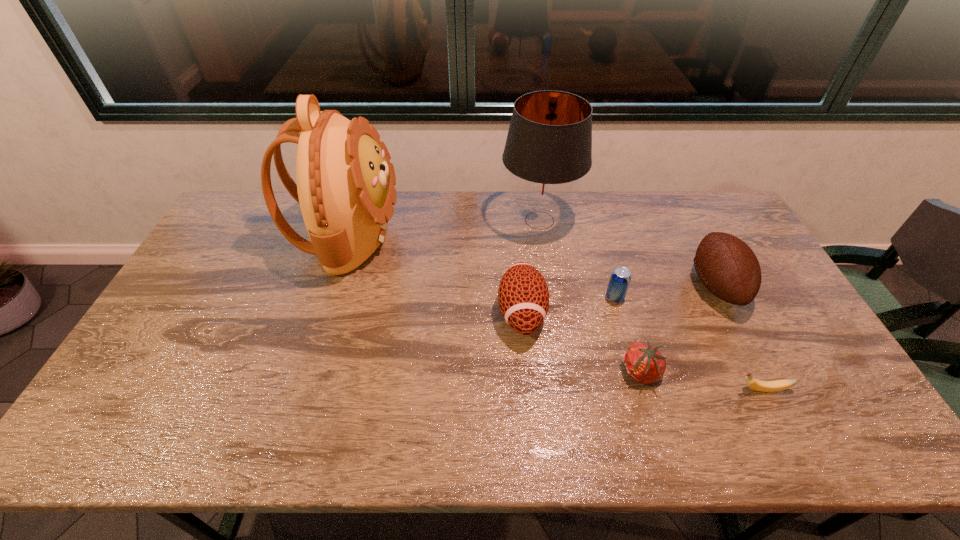
The height and width of the screenshot is (540, 960). What are the coordinates of `backpack` in the screenshot? It's located at (345, 181).

The height and width of the screenshot is (540, 960). What are the coordinates of `the sixth shortest object` in the screenshot? It's located at (548, 148).

The width and height of the screenshot is (960, 540). I want to click on the right football, so click(x=727, y=266).

This screenshot has width=960, height=540. What are the coordinates of `the left football` in the screenshot? It's located at (523, 296).

Identify the location of the third shortest object. pos(620,278).

Locate an element on the screen. tomato is located at coordinates (644, 363).

Identify the location of banana. (764, 386).

I want to click on free space located on the front-facing side of the leftmost object, so click(441, 237).

Where is `vacant space situated 0.260m on the left of the lampshade`? This screenshot has height=540, width=960. vacant space situated 0.260m on the left of the lampshade is located at coordinates (427, 220).

The height and width of the screenshot is (540, 960). Identify the location of vacant space located 0.320m on the laces of the right football. (587, 286).